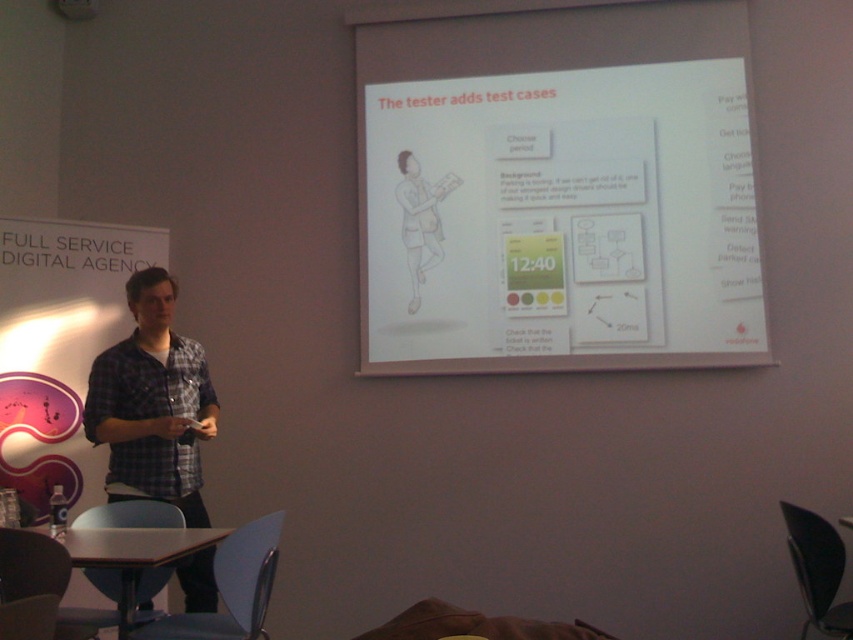
You are an attendee at the presentation and notice two items in the scene. Which item is taller between the plaid cotton shirt at left and the matte white projector at upper center?

The plaid cotton shirt at left is taller than the matte white projector at upper center.

You are an attendee at a presentation and want to see both the plaid cotton shirt at left and the white paper at upper center clearly. Can you move your seat to a position where you can see both without any obstruction?

The plaid cotton shirt at left is behind the white paper at upper center, so moving your seat to a position where you can see around or past the white paper at upper center might allow you to view both. However, since the plaid cotton shirt at left is obstructed by the white paper at upper center, it depends on the angle and distance from which you can see both objects without obstruction.

You are an attendee at a conference and you see the plaid cotton shirt at left and the matte white projector at upper center. Which object is wider?

The plaid cotton shirt at left is wider than the matte white projector at upper center.